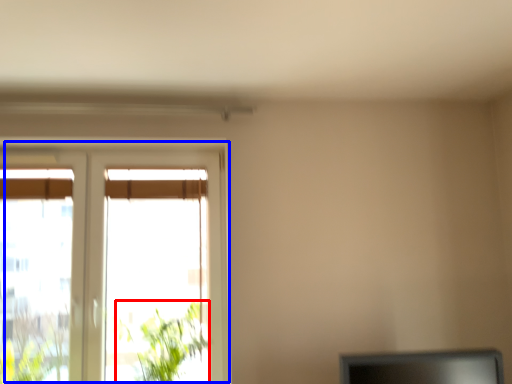
Question: Which point is closer to the camera, plant (highlighted by a red box) or window (highlighted by a blue box)?

Choices:
 (A) plant
 (B) window

Answer: (A)